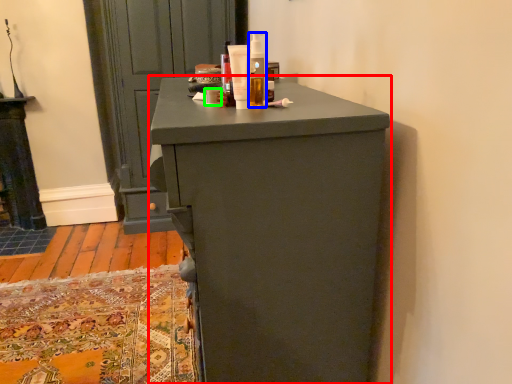
Question: Which object is the closest to the chest of drawers (highlighted by a red box)? Choose among these: toiletry (highlighted by a blue box) or toiletry (highlighted by a green box).

Choices:
 (A) toiletry
 (B) toiletry

Answer: (A)